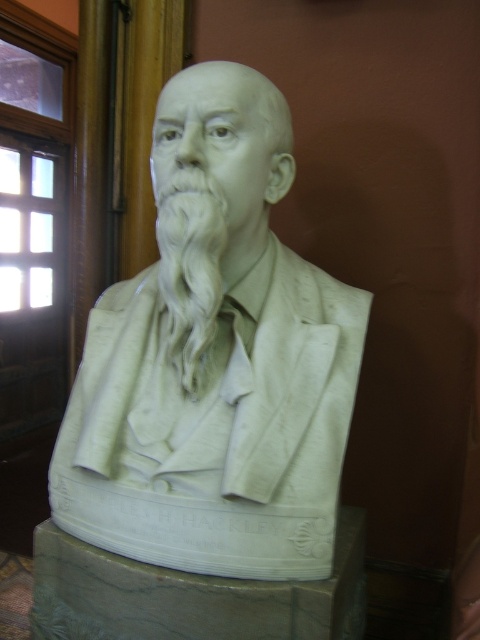
Can you confirm if white marble bust at center is taller than white marble beard at center?

Indeed, white marble bust at center has a greater height compared to white marble beard at center.

This screenshot has width=480, height=640. Describe the element at coordinates (215, 360) in the screenshot. I see `white marble bust at center` at that location.

The height and width of the screenshot is (640, 480). What do you see at coordinates (215, 360) in the screenshot?
I see `white marble bust at center` at bounding box center [215, 360].

This screenshot has height=640, width=480. What are the coordinates of `white marble bust at center` in the screenshot? It's located at (215, 360).